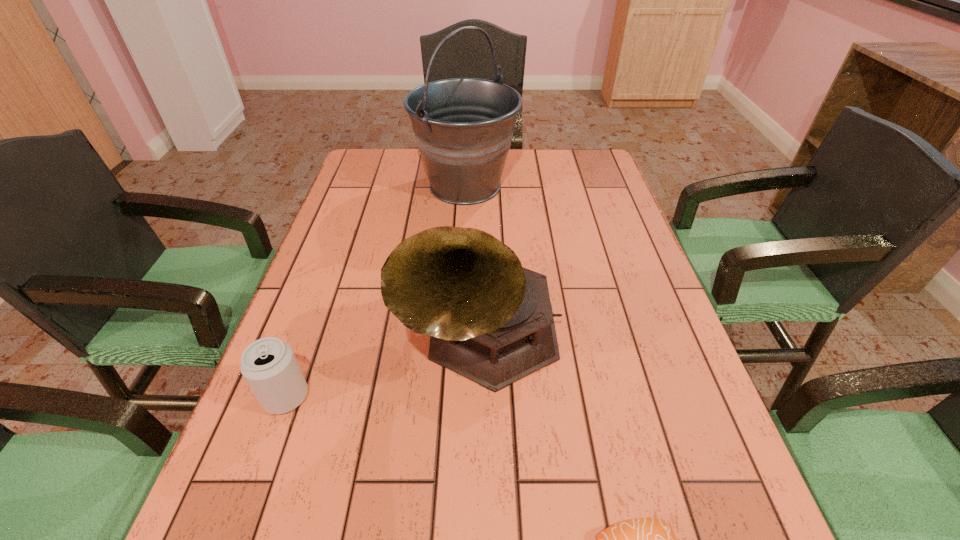
Identify the location of free space at the far edge of the desktop. (531, 173).

In the image, there is a desktop. Identify the location of vacant space at the left edge. This screenshot has height=540, width=960. tap(327, 352).

Image resolution: width=960 pixels, height=540 pixels. Find the location of `vacant space at the right edge of the desktop`. vacant space at the right edge of the desktop is located at coordinates (608, 208).

I want to click on vacant area between the second tallest object and the leftmost object, so click(x=384, y=367).

At what (x,y) coordinates should I click in order to perform the action: click on free space between the phonograph record and the third tallest object. Please return your answer as a coordinate pair (x, y). Looking at the image, I should click on (384, 367).

Point out which object is positioned as the second nearest to the farthest object. Please provide its 2D coordinates. Your answer should be formatted as a tuple, i.e. [(x, y)], where the tuple contains the x and y coordinates of a point satisfying the conditions above.

[(269, 366)]

The image size is (960, 540). I want to click on object that can be found as the second closest to the farthest object, so click(x=269, y=366).